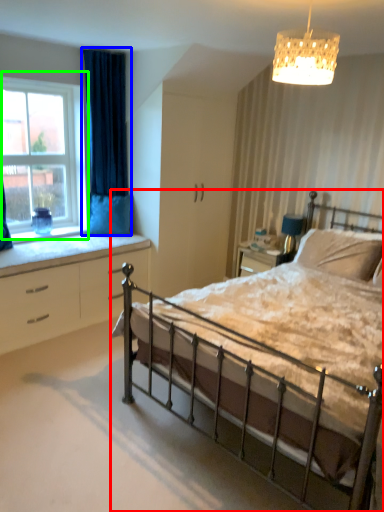
Question: Which object is positioned farthest from bed (highlighted by a red box)? Select from curtain (highlighted by a blue box) and window (highlighted by a green box).

Choices:
 (A) curtain
 (B) window

Answer: (B)